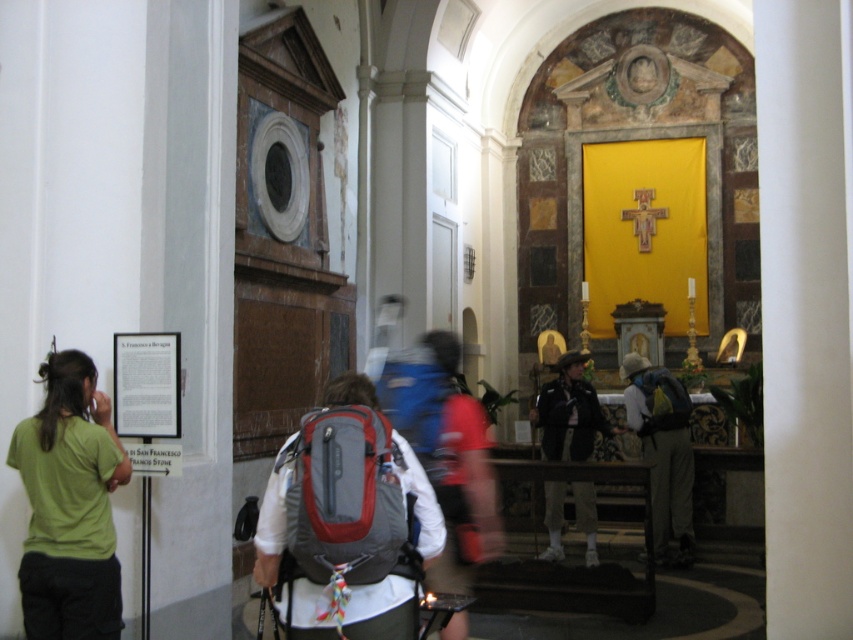
You are standing in the church and want to take a photo of two specific points marked in the scene. The first point is at coordinates point (456, 358) and the second point is at point (648, 451). Which point will appear larger in your photo?

Point (456, 358) will appear larger in the photo because it is closer to the camera than point (648, 451).

In the scene shown: You are a visitor to the church and want to place both the red backpack at center and the yellow fabric backpack at center into a storage locker that can hold items up to the size of the larger backpack. Which backpack should you use as the size reference for the locker?

The red backpack at center is larger in size than the yellow fabric backpack at center, so you should use the red backpack at center as the size reference for the locker.